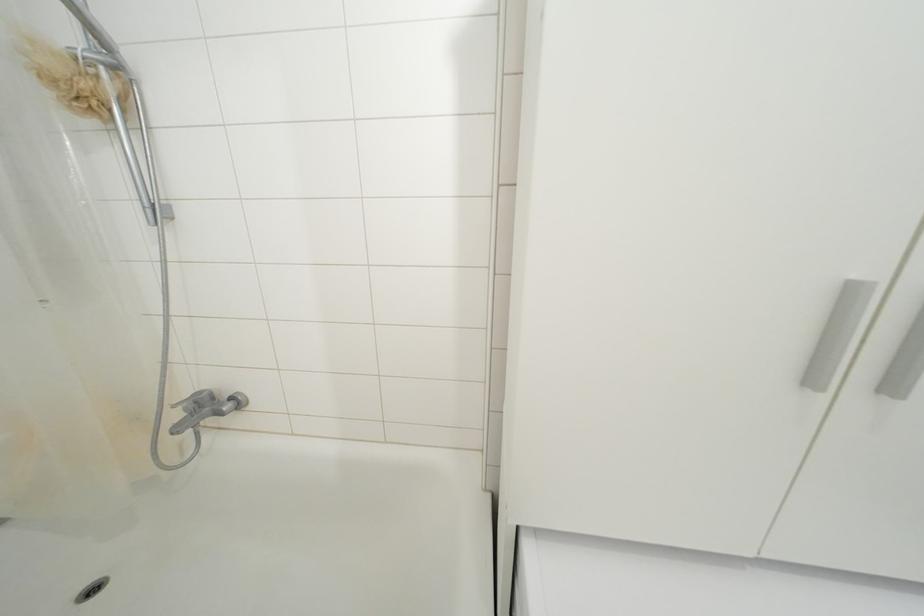
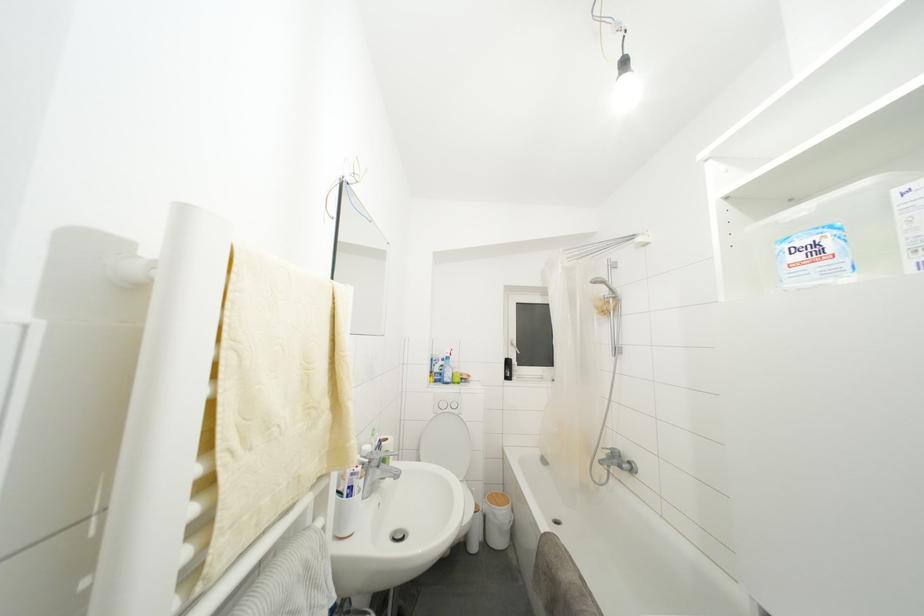
Question: The camera is either moving clockwise (left) or counter-clockwise (right) around the object. The first image is from the beginning of the video and the second image is from the end. Is the camera moving left or right when shooting the video?

Choices:
 (A) Left
 (B) Right

Answer: (B)